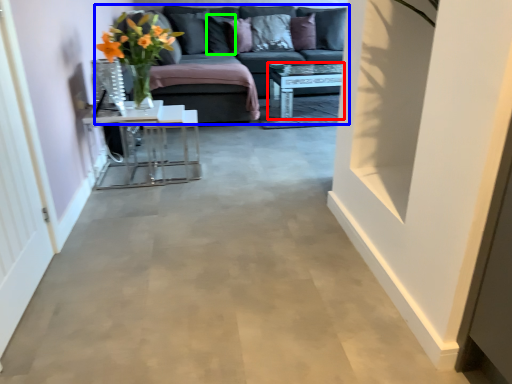
Question: Which is farther away from table (highlighted by a red box)? studio couch (highlighted by a blue box) or pillow (highlighted by a green box)?

Choices:
 (A) studio couch
 (B) pillow

Answer: (B)